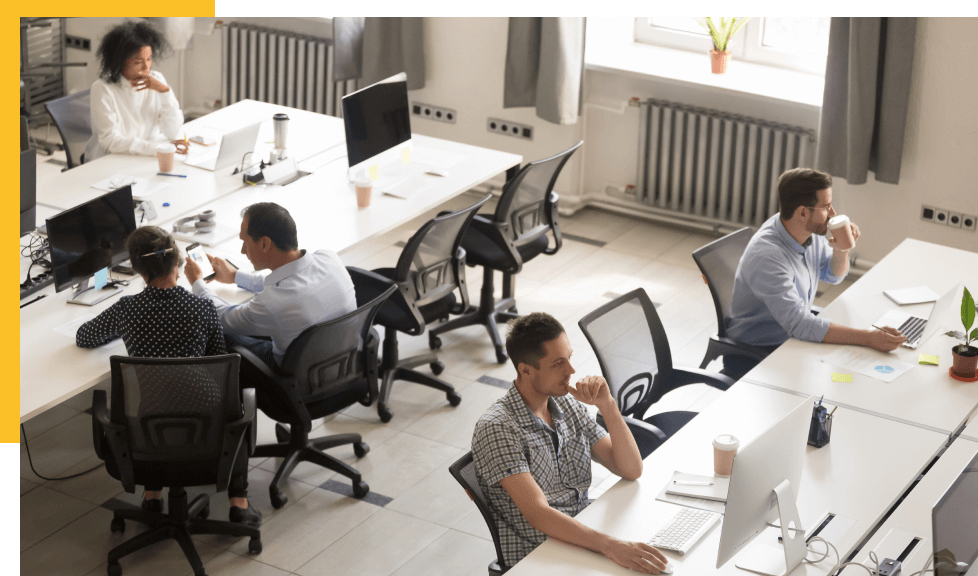
In order to click on coffee cup in this screenshot , I will do `click(276, 127)`, `click(163, 154)`, `click(359, 188)`, `click(719, 448)`, `click(839, 237)`.